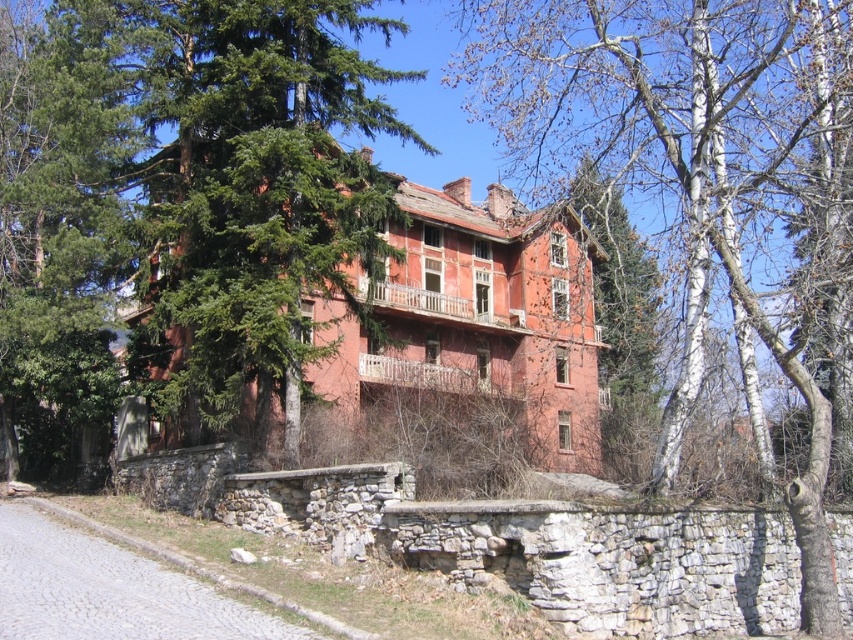
Is bare birch tree at upper right wider than green coniferous tree at upper left?

Yes.

Can you confirm if bare birch tree at upper right is bigger than green coniferous tree at upper left?

Yes.

What do you see at coordinates (706, 179) in the screenshot? I see `bare birch tree at upper right` at bounding box center [706, 179].

Locate an element on the screen. Image resolution: width=853 pixels, height=640 pixels. bare birch tree at upper right is located at coordinates (706, 179).